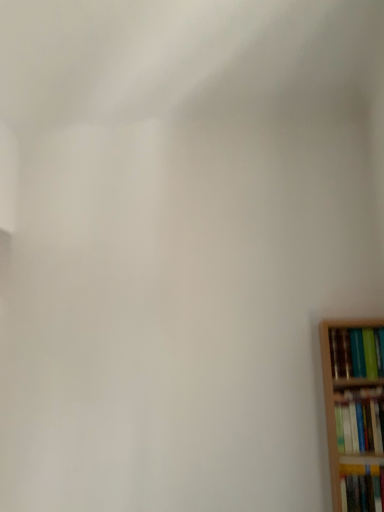
I want to click on hardcover book at right, which is the second book from bottom to top, so click(x=360, y=420).

Identify the location of hardcover book at right, the second book in the top-to-bottom sequence. (360, 420).

Is hardcover book at right, the first book when ordered from top to bottom, in front of or behind hardcover book at lower right, the third book in the top-to-bottom sequence, in the image?

Clearly, hardcover book at right, the first book when ordered from top to bottom, is behind hardcover book at lower right, the third book in the top-to-bottom sequence.

Is hardcover book at right, which is the 3th book in bottom-to-top order, located outside hardcover book at lower right, the third book in the top-to-bottom sequence?

Indeed, hardcover book at right, which is the 3th book in bottom-to-top order, is completely outside hardcover book at lower right, the third book in the top-to-bottom sequence.

Considering the relative sizes of hardcover book at right, which is the 3th book in bottom-to-top order, and hardcover book at lower right, positioned as the first book in bottom-to-top order, in the image provided, is hardcover book at right, which is the 3th book in bottom-to-top order, thinner than hardcover book at lower right, positioned as the first book in bottom-to-top order,?

In fact, hardcover book at right, which is the 3th book in bottom-to-top order, might be wider than hardcover book at lower right, positioned as the first book in bottom-to-top order.

From the picture: Considering the relative positions of hardcover book at right, which is the 3th book in bottom-to-top order, and hardcover book at lower right, positioned as the first book in bottom-to-top order, in the image provided, is hardcover book at right, which is the 3th book in bottom-to-top order, to the left of hardcover book at lower right, positioned as the first book in bottom-to-top order, from the viewer's perspective?

Yes.

From a real-world perspective, which object stands above the other?

hardcover book at right, which is the second book from bottom to top, is physically above.

Which object is positioned more to the right, hardcover book at lower right, the third book in the top-to-bottom sequence, or hardcover book at right, the second book in the top-to-bottom sequence?

hardcover book at lower right, the third book in the top-to-bottom sequence.

Does hardcover book at lower right, positioned as the first book in bottom-to-top order, turn towards hardcover book at right, the second book in the top-to-bottom sequence?

No, hardcover book at lower right, positioned as the first book in bottom-to-top order, does not turn towards hardcover book at right, the second book in the top-to-bottom sequence.

Is hardcover book at lower right, positioned as the first book in bottom-to-top order, not within hardcover book at right, which is the second book from bottom to top?

That's correct, hardcover book at lower right, positioned as the first book in bottom-to-top order, is outside of hardcover book at right, which is the second book from bottom to top.

Is hardcover book at lower right, the third book in the top-to-bottom sequence, inside or outside of hardcover book at right, the first book when ordered from top to bottom?

hardcover book at lower right, the third book in the top-to-bottom sequence, is outside hardcover book at right, the first book when ordered from top to bottom.

Is hardcover book at lower right, positioned as the first book in bottom-to-top order, positioned far away from hardcover book at right, the first book when ordered from top to bottom?

They are positioned close to each other.

Who is bigger, hardcover book at lower right, the third book in the top-to-bottom sequence, or hardcover book at right, the first book when ordered from top to bottom?

hardcover book at right, the first book when ordered from top to bottom.

Is the position of hardcover book at lower right, positioned as the first book in bottom-to-top order, more distant than that of hardcover book at right, the first book when ordered from top to bottom?

No, it is in front of hardcover book at right, the first book when ordered from top to bottom.

Which of these two, hardcover book at right, which is the second book from bottom to top, or hardcover book at right, the first book when ordered from top to bottom, stands taller?

hardcover book at right, which is the second book from bottom to top, is taller.

Is point (340, 398) closer to camera compared to point (368, 360)?

No, (340, 398) is further to viewer.

Between hardcover book at right, the second book in the top-to-bottom sequence, and hardcover book at right, which is the 3th book in bottom-to-top order, which one has larger size?

With larger size is hardcover book at right, which is the 3th book in bottom-to-top order.

How many degrees apart are the facing directions of hardcover book at right, the second book in the top-to-bottom sequence, and hardcover book at right, which is the 3th book in bottom-to-top order?

The angular difference between hardcover book at right, the second book in the top-to-bottom sequence, and hardcover book at right, which is the 3th book in bottom-to-top order, is 0.000315 degrees.

From the picture: Is there a large distance between hardcover book at right, the second book in the top-to-bottom sequence, and hardcover book at lower right, the third book in the top-to-bottom sequence?

hardcover book at right, the second book in the top-to-bottom sequence, is actually quite close to hardcover book at lower right, the third book in the top-to-bottom sequence.

Find the location of a particular element. This screenshot has height=512, width=384. book that is below the hardcover book at right, the second book in the top-to-bottom sequence (from the image's perspective) is located at coordinates (362, 488).

Is hardcover book at right, the second book in the top-to-bottom sequence, oriented towards hardcover book at lower right, the third book in the top-to-bottom sequence?

No, hardcover book at right, the second book in the top-to-bottom sequence, is not aimed at hardcover book at lower right, the third book in the top-to-bottom sequence.

How different are the orientations of hardcover book at right, the second book in the top-to-bottom sequence, and hardcover book at lower right, the third book in the top-to-bottom sequence, in degrees?

2.7 degrees separate the facing orientations of hardcover book at right, the second book in the top-to-bottom sequence, and hardcover book at lower right, the third book in the top-to-bottom sequence.

Considering the sizes of objects hardcover book at right, which is the 3th book in bottom-to-top order, and hardcover book at right, the second book in the top-to-bottom sequence, in the image provided, who is thinner, hardcover book at right, which is the 3th book in bottom-to-top order, or hardcover book at right, the second book in the top-to-bottom sequence,?

hardcover book at right, the second book in the top-to-bottom sequence.

Is hardcover book at right, the first book when ordered from top to bottom, at the right side of hardcover book at right, the second book in the top-to-bottom sequence?

Yes, hardcover book at right, the first book when ordered from top to bottom, is to the right of hardcover book at right, the second book in the top-to-bottom sequence.

From their relative heights in the image, would you say hardcover book at right, the first book when ordered from top to bottom, is taller or shorter than hardcover book at right, the second book in the top-to-bottom sequence?

hardcover book at right, the first book when ordered from top to bottom, is shorter than hardcover book at right, the second book in the top-to-bottom sequence.

Is the position of hardcover book at right, the first book when ordered from top to bottom, less distant than that of hardcover book at right, the second book in the top-to-bottom sequence?

No, hardcover book at right, the first book when ordered from top to bottom, is further to the viewer.

At what (x,y) coordinates should I click in order to perform the action: click on the 2nd book located beneath the hardcover book at right, the first book when ordered from top to bottom (from a real-world perspective). Please return your answer as a coordinate pair (x, y). Image resolution: width=384 pixels, height=512 pixels. Looking at the image, I should click on (362, 488).

There is a hardcover book at lower right, the third book in the top-to-bottom sequence. At what (x,y) coordinates should I click in order to perform the action: click on the 1st book above it (from a real-world perspective). Please return your answer as a coordinate pair (x, y). Looking at the image, I should click on (360, 420).

Estimate the real-world distances between objects in this image. Which object is closer to hardcover book at right, which is the second book from bottom to top, hardcover book at lower right, the third book in the top-to-bottom sequence, or hardcover book at right, which is the 3th book in bottom-to-top order?

hardcover book at lower right, the third book in the top-to-bottom sequence, is positioned closer to the anchor hardcover book at right, which is the second book from bottom to top.

Estimate the real-world distances between objects in this image. Which object is further from hardcover book at right, which is the 3th book in bottom-to-top order, hardcover book at lower right, the third book in the top-to-bottom sequence, or hardcover book at right, which is the second book from bottom to top?

hardcover book at lower right, the third book in the top-to-bottom sequence.

Estimate the real-world distances between objects in this image. Which object is closer to hardcover book at right, which is the second book from bottom to top, hardcover book at right, the first book when ordered from top to bottom, or hardcover book at lower right, positioned as the first book in bottom-to-top order?

hardcover book at lower right, positioned as the first book in bottom-to-top order.

Which object lies further to the anchor point hardcover book at right, which is the 3th book in bottom-to-top order, hardcover book at right, the second book in the top-to-bottom sequence, or hardcover book at lower right, positioned as the first book in bottom-to-top order?

hardcover book at lower right, positioned as the first book in bottom-to-top order, is further to hardcover book at right, which is the 3th book in bottom-to-top order.

Consider the image. Estimate the real-world distances between objects in this image. Which object is further from hardcover book at lower right, positioned as the first book in bottom-to-top order, hardcover book at right, the first book when ordered from top to bottom, or hardcover book at right, which is the second book from bottom to top?

hardcover book at right, the first book when ordered from top to bottom, is positioned further to the anchor hardcover book at lower right, positioned as the first book in bottom-to-top order.

When comparing their distances from hardcover book at lower right, the third book in the top-to-bottom sequence, does hardcover book at right, the second book in the top-to-bottom sequence, or hardcover book at right, the first book when ordered from top to bottom, seem further?

hardcover book at right, the first book when ordered from top to bottom, is further to hardcover book at lower right, the third book in the top-to-bottom sequence.

Locate an element on the screen. book that lies between hardcover book at right, which is the 3th book in bottom-to-top order, and hardcover book at lower right, the third book in the top-to-bottom sequence, from top to bottom is located at coordinates (360, 420).